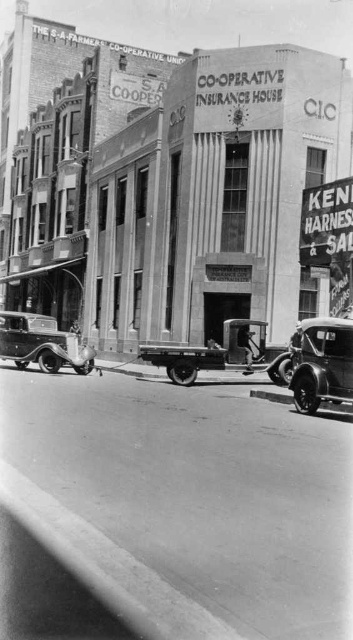
Question: Is shiny chrome car at right to the left of shiny silver car at lower left from the viewer's perspective?

Choices:
 (A) no
 (B) yes

Answer: (A)

Question: Does shiny chrome car at right appear on the left side of shiny silver car at lower left?

Choices:
 (A) no
 (B) yes

Answer: (A)

Question: Which of the following is the closest to the observer?

Choices:
 (A) shiny silver car at lower left
 (B) shiny chrome car at right

Answer: (B)

Question: Can you confirm if shiny chrome car at right is positioned to the right of shiny silver car at lower left?

Choices:
 (A) yes
 (B) no

Answer: (A)

Question: Which object is farther from the camera taking this photo?

Choices:
 (A) shiny chrome car at right
 (B) shiny silver car at lower left

Answer: (B)